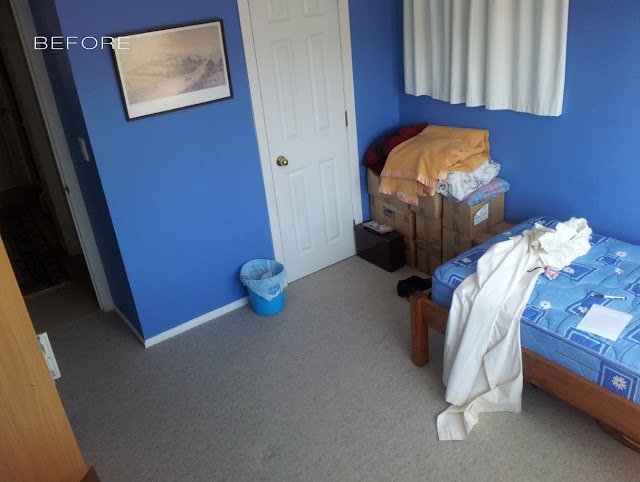
This screenshot has width=640, height=482. I want to click on blue wastebasket, so click(260, 304).